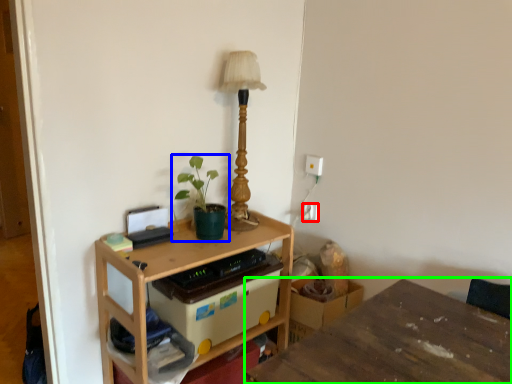
Question: Based on their relative distances, which object is nearer to electric outlet (highlighted by a red box)? Choose from houseplant (highlighted by a blue box) and table (highlighted by a green box).

Choices:
 (A) houseplant
 (B) table

Answer: (A)